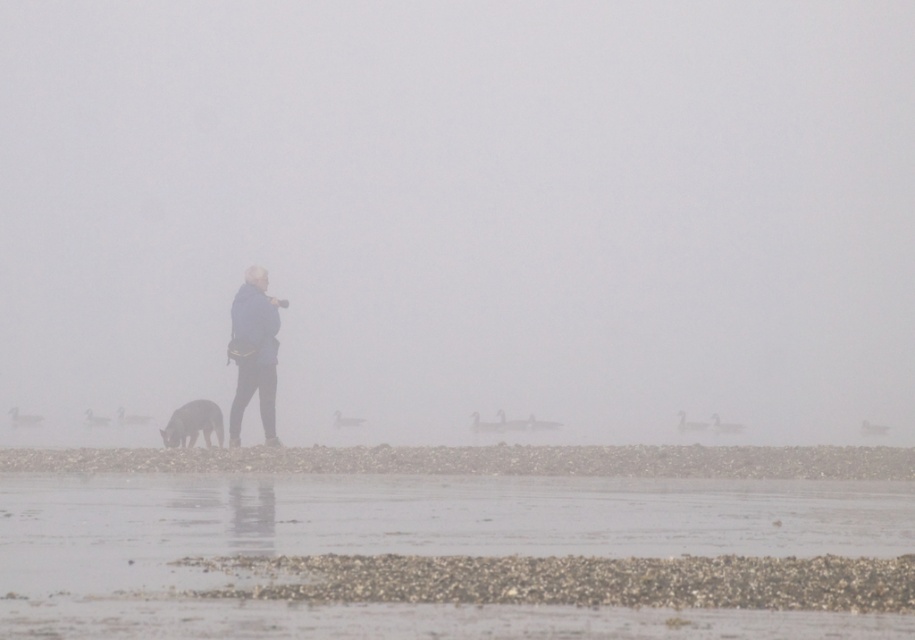
Question: Which object is positioned closest to the foggy atmosphere at center?

Choices:
 (A) smooth pebbles at center
 (B) shiny brown fur at lower left

Answer: (B)

Question: Where is foggy atmosphere at center located in relation to shiny brown fur at lower left in the image?

Choices:
 (A) below
 (B) above

Answer: (B)

Question: Which of the following is the farthest from the observer?

Choices:
 (A) pos(424,628)
 (B) pos(164,394)

Answer: (B)

Question: Is foggy atmosphere at center in front of blue fabric jacket at center?

Choices:
 (A) no
 (B) yes

Answer: (A)

Question: Based on their relative distances, which object is farther from the blue fabric jacket at center?

Choices:
 (A) shiny brown fur at lower left
 (B) smooth pebbles at center

Answer: (B)

Question: Can you confirm if foggy atmosphere at center is positioned below smooth pebbles at center?

Choices:
 (A) no
 (B) yes

Answer: (A)